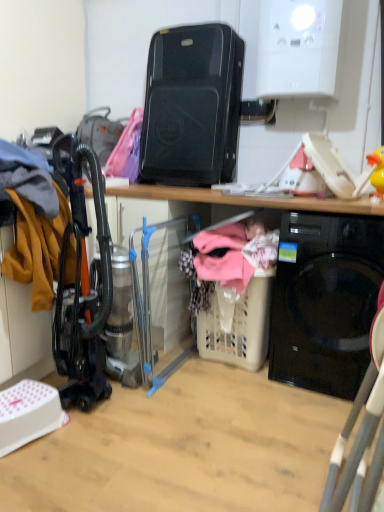
Identify the location of black plastic speaker at upper center, positioned as the second appliance in bottom-to-top order. The image size is (384, 512). (192, 106).

Can you confirm if black glossy washing machine at lower right is taller than black plastic speaker at upper center, positioned as the second appliance in bottom-to-top order?

Correct, black glossy washing machine at lower right is much taller as black plastic speaker at upper center, positioned as the second appliance in bottom-to-top order.

Is black glossy washing machine at lower right positioned before black plastic speaker at upper center, the first appliance positioned from the top?

Yes, it is in front of black plastic speaker at upper center, the first appliance positioned from the top.

From the image's perspective, relative to black plastic speaker at upper center, positioned as the second appliance in bottom-to-top order, is black glossy washing machine at lower right above or below?

From the image's perspective, black glossy washing machine at lower right appears below black plastic speaker at upper center, positioned as the second appliance in bottom-to-top order.

Which object is positioned more to the left, clear plastic laundry basket at center, the 1th appliance positioned from the bottom, or black plastic speaker at upper center, positioned as the second appliance in bottom-to-top order?

From the viewer's perspective, clear plastic laundry basket at center, the 1th appliance positioned from the bottom, appears more on the left side.

Does point (178, 222) appear closer or farther from the camera than point (226, 42)?

Point (178, 222).

From the image's perspective, would you say clear plastic laundry basket at center, which appears as the second appliance when viewed from the top, is shown under black plastic speaker at upper center, the first appliance positioned from the top?

Correct, clear plastic laundry basket at center, which appears as the second appliance when viewed from the top, appears lower than black plastic speaker at upper center, the first appliance positioned from the top, in the image.

How distant is beige plastic laundry basket at lower center from clear plastic laundry basket at center, the 1th appliance positioned from the bottom?

beige plastic laundry basket at lower center is 15.23 inches from clear plastic laundry basket at center, the 1th appliance positioned from the bottom.

Are beige plastic laundry basket at lower center and clear plastic laundry basket at center, which appears as the second appliance when viewed from the top, located far from each other?

beige plastic laundry basket at lower center is actually quite close to clear plastic laundry basket at center, which appears as the second appliance when viewed from the top.

Is beige plastic laundry basket at lower center wider or thinner than clear plastic laundry basket at center, which appears as the second appliance when viewed from the top?

beige plastic laundry basket at lower center is thinner than clear plastic laundry basket at center, which appears as the second appliance when viewed from the top.

From the picture: Does beige plastic laundry basket at lower center have a larger size compared to clear plastic laundry basket at center, which appears as the second appliance when viewed from the top?

Actually, beige plastic laundry basket at lower center might be smaller than clear plastic laundry basket at center, which appears as the second appliance when viewed from the top.

In the image, there is a black glossy washing machine at lower right. Where is `basket below it (from the image's perspective)`? This screenshot has height=512, width=384. basket below it (from the image's perspective) is located at coordinates (239, 326).

Is beige plastic laundry basket at lower center behind black glossy washing machine at lower right?

Yes, it is.

How many degrees apart are the facing directions of beige plastic laundry basket at lower center and black glossy washing machine at lower right?

beige plastic laundry basket at lower center and black glossy washing machine at lower right are facing 5.59 degrees away from each other.

Does beige plastic laundry basket at lower center have a smaller size compared to black glossy washing machine at lower right?

Indeed, beige plastic laundry basket at lower center has a smaller size compared to black glossy washing machine at lower right.

Between black glossy washing machine at lower right and clear plastic laundry basket at center, the 1th appliance positioned from the bottom, which one has more height?

With more height is clear plastic laundry basket at center, the 1th appliance positioned from the bottom.

Would you consider black glossy washing machine at lower right to be distant from clear plastic laundry basket at center, the 1th appliance positioned from the bottom?

No, black glossy washing machine at lower right is in close proximity to clear plastic laundry basket at center, the 1th appliance positioned from the bottom.

Is point (334, 370) positioned before point (133, 268)?

No, (334, 370) is further to viewer.

Measure the distance between black glossy washing machine at lower right and clear plastic laundry basket at center, which appears as the second appliance when viewed from the top.

The distance of black glossy washing machine at lower right from clear plastic laundry basket at center, which appears as the second appliance when viewed from the top, is 29.49 inches.

Between black plastic speaker at upper center, the first appliance positioned from the top, and beige plastic laundry basket at lower center, which one has less height?

beige plastic laundry basket at lower center is shorter.

Considering the sizes of black plastic speaker at upper center, the first appliance positioned from the top, and beige plastic laundry basket at lower center in the image, is black plastic speaker at upper center, the first appliance positioned from the top, wider or thinner than beige plastic laundry basket at lower center?

Considering their sizes, black plastic speaker at upper center, the first appliance positioned from the top, looks broader than beige plastic laundry basket at lower center.

From the image's perspective, does black plastic speaker at upper center, positioned as the second appliance in bottom-to-top order, appear lower than beige plastic laundry basket at lower center?

No, from the image's perspective, black plastic speaker at upper center, positioned as the second appliance in bottom-to-top order, is not beneath beige plastic laundry basket at lower center.

Considering the points (223, 331) and (208, 53), which point is in front, point (223, 331) or point (208, 53)?

Positioned in front is point (223, 331).

From the picture: Does beige plastic laundry basket at lower center have a greater height compared to black plastic speaker at upper center, positioned as the second appliance in bottom-to-top order?

In fact, beige plastic laundry basket at lower center may be shorter than black plastic speaker at upper center, positioned as the second appliance in bottom-to-top order.

Which object is thinner, beige plastic laundry basket at lower center or black plastic speaker at upper center, the first appliance positioned from the top?

beige plastic laundry basket at lower center is thinner.

Starting from the black glossy washing machine at lower right, which appliance is the 1st one to the left? Please provide its 2D coordinates.

[(192, 106)]

Identify the location of appliance that is in front of the black plastic speaker at upper center, the first appliance positioned from the top. (150, 304).

Estimate the real-world distances between objects in this image. Which object is closer to black glossy washing machine at lower right, clear plastic laundry basket at center, which appears as the second appliance when viewed from the top, or beige plastic laundry basket at lower center?

Among the two, beige plastic laundry basket at lower center is located nearer to black glossy washing machine at lower right.

Considering their positions, is black plastic speaker at upper center, the first appliance positioned from the top, positioned closer to beige plastic laundry basket at lower center than black glossy washing machine at lower right?

black glossy washing machine at lower right lies closer to beige plastic laundry basket at lower center than the other object.

Looking at the image, which one is located closer to black glossy washing machine at lower right, black plastic speaker at upper center, the first appliance positioned from the top, or clear plastic laundry basket at center, which appears as the second appliance when viewed from the top?

Among the two, clear plastic laundry basket at center, which appears as the second appliance when viewed from the top, is located nearer to black glossy washing machine at lower right.

When comparing their distances from clear plastic laundry basket at center, which appears as the second appliance when viewed from the top, does beige plastic laundry basket at lower center or black glossy washing machine at lower right seem further?

black glossy washing machine at lower right is further to clear plastic laundry basket at center, which appears as the second appliance when viewed from the top.

From the image, which object appears to be farther from black plastic speaker at upper center, the first appliance positioned from the top, black glossy washing machine at lower right or clear plastic laundry basket at center, the 1th appliance positioned from the bottom?

black glossy washing machine at lower right.

Considering their positions, is clear plastic laundry basket at center, which appears as the second appliance when viewed from the top, positioned closer to beige plastic laundry basket at lower center than black plastic speaker at upper center, positioned as the second appliance in bottom-to-top order?

clear plastic laundry basket at center, which appears as the second appliance when viewed from the top, is positioned closer to the anchor beige plastic laundry basket at lower center.

Which object lies nearer to the anchor point clear plastic laundry basket at center, which appears as the second appliance when viewed from the top, black glossy washing machine at lower right or black plastic speaker at upper center, positioned as the second appliance in bottom-to-top order?

black plastic speaker at upper center, positioned as the second appliance in bottom-to-top order, is positioned closer to the anchor clear plastic laundry basket at center, which appears as the second appliance when viewed from the top.

From the image, which object appears to be nearer to black plastic speaker at upper center, the first appliance positioned from the top, beige plastic laundry basket at lower center or black glossy washing machine at lower right?

Based on the image, black glossy washing machine at lower right appears to be nearer to black plastic speaker at upper center, the first appliance positioned from the top.

Identify the location of home appliance between black plastic speaker at upper center, positioned as the second appliance in bottom-to-top order, and beige plastic laundry basket at lower center, in the vertical direction. [x=325, y=301].

This screenshot has width=384, height=512. What are the coordinates of `appliance between black plastic speaker at upper center, the first appliance positioned from the top, and black glossy washing machine at lower right in the up-down direction` in the screenshot? It's located at (150, 304).

Identify the location of basket between clear plastic laundry basket at center, the 1th appliance positioned from the bottom, and black glossy washing machine at lower right. This screenshot has height=512, width=384. (239, 326).

Locate an element on the screen. This screenshot has width=384, height=512. appliance between black plastic speaker at upper center, the first appliance positioned from the top, and beige plastic laundry basket at lower center, in the vertical direction is located at coordinates (150, 304).